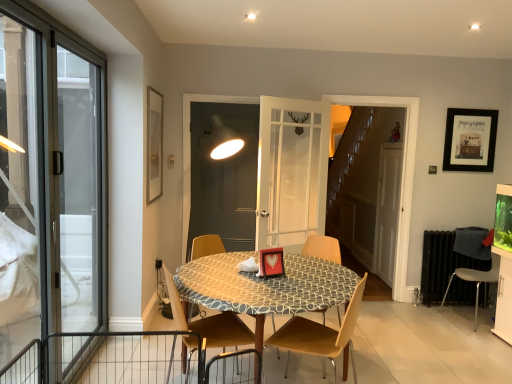
Question: Visually, is matte gold picture frame at upper left, which appears as the first picture frame when viewed from the front, positioned to the left or to the right of matte gray screen door at center, the 2th screen door positioned from the right?

Choices:
 (A) left
 (B) right

Answer: (A)

Question: In terms of size, does matte gold picture frame at upper left, which appears as the first picture frame when viewed from the front, appear bigger or smaller than matte gray screen door at center, the 2th screen door positioned from the right?

Choices:
 (A) big
 (B) small

Answer: (B)

Question: Which of these objects is positioned closest to the transparent glass door at left, the second window viewed from the front?

Choices:
 (A) matte gold picture frame at upper left, positioned as the second picture frame in back-to-front order
 (B) gray fabric chair at lower right, placed as the 4th chair when sorted from left to right
 (C) patterned fabric table at center
 (D) wooden chair at center, which is counted as the 3th chair, starting from the left
 (E) transparent glass door at left, the 2th window viewed from the back

Answer: (E)

Question: Which is farther from the wooden stairs at center?

Choices:
 (A) transparent glass door at left
 (B) wooden chair at center, the 2th chair viewed from the right
 (C) transparent glass door at left, the first window in the front-to-back sequence
 (D) wooden chair at center, which appears as the 3th chair when viewed from the right
 (E) gray fabric chair at lower right, placed as the 4th chair when sorted from left to right

Answer: (C)